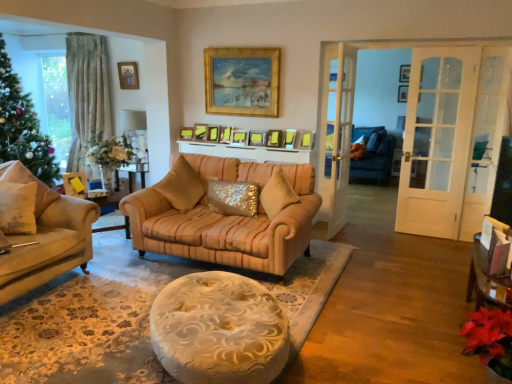
In order to face gold sequined pillow at center, the 3th pillow when ordered from right to left, should I rotate leftwards or rightwards?

A 9.716 degree turn to the left will do.

What is the approximate width of matte gold picture frame at center, which is the fourth picture frame in front-to-back order?

matte gold picture frame at center, which is the fourth picture frame in front-to-back order, is 4.35 inches in width.

Find the location of `matte yellow picture frame at center, marked as the eighth picture frame in a front-to-back arrangement`. matte yellow picture frame at center, marked as the eighth picture frame in a front-to-back arrangement is located at coordinates (200, 132).

Where is `wooden picture frame at upper center, the 2th picture frame from the back`? The image size is (512, 384). wooden picture frame at upper center, the 2th picture frame from the back is located at coordinates (404, 73).

You are a GUI agent. You are given a task and a screenshot of the screen. Output one action in this format:
    pyautogui.click(x=<x>, y=<y>)
    Task: Click on the picture frame on the left of matte white lampshade at upper left
    This screenshot has height=384, width=512.
    Given the screenshot: What is the action you would take?
    pyautogui.click(x=128, y=75)

From the image's perspective, is wooden picture frame at upper left, the 1th picture frame in the left-to-right sequence, positioned above or below matte white lampshade at upper left?

Clearly, from the image's perspective, wooden picture frame at upper left, the 1th picture frame in the left-to-right sequence, is above matte white lampshade at upper left.

Is wooden picture frame at upper left, the 3th picture frame positioned from the back, next to matte white lampshade at upper left and touching it?

There is a gap between wooden picture frame at upper left, the 3th picture frame positioned from the back, and matte white lampshade at upper left.

From the image's perspective, which is below, gold-framed painting at upper center, which is the sixth picture frame from right to left, or matte silver picture frame at center, which ranks as the 6th picture frame in left-to-right order?

matte silver picture frame at center, which ranks as the 6th picture frame in left-to-right order, is shown below in the image.

Is gold-framed painting at upper center, which is the sixth picture frame from right to left, not close to matte silver picture frame at center, the fifth picture frame positioned from the front?

No, gold-framed painting at upper center, which is the sixth picture frame from right to left, is not far away from matte silver picture frame at center, the fifth picture frame positioned from the front.

Does gold-framed painting at upper center, which is the first picture frame from front to back, contain matte silver picture frame at center, marked as the eighth picture frame in a back-to-front arrangement?

Definitely not — matte silver picture frame at center, marked as the eighth picture frame in a back-to-front arrangement, is not inside gold-framed painting at upper center, which is the first picture frame from front to back.

Considering the relative sizes of gold-framed painting at upper center, which is the sixth picture frame from right to left, and matte silver picture frame at center, which ranks as the 6th picture frame in left-to-right order, in the image provided, is gold-framed painting at upper center, which is the sixth picture frame from right to left, thinner than matte silver picture frame at center, which ranks as the 6th picture frame in left-to-right order,?

Yes, gold-framed painting at upper center, which is the sixth picture frame from right to left, is thinner than matte silver picture frame at center, which ranks as the 6th picture frame in left-to-right order.

Is wooden picture frame at upper center, marked as the twelfth picture frame in a front-to-back arrangement, placed right next to wooden picture frame at upper center, which is the 11th picture frame from front to back?

No, wooden picture frame at upper center, marked as the twelfth picture frame in a front-to-back arrangement, is not making contact with wooden picture frame at upper center, which is the 11th picture frame from front to back.

Is wooden picture frame at upper center, which is the second picture frame in right-to-left order, inside or outside of wooden picture frame at upper center, the twelfth picture frame positioned from the left?

wooden picture frame at upper center, which is the second picture frame in right-to-left order, is outside wooden picture frame at upper center, the twelfth picture frame positioned from the left.

Is the position of wooden picture frame at upper center, marked as the twelfth picture frame in a front-to-back arrangement, more distant than that of wooden picture frame at upper center, the twelfth picture frame positioned from the left?

Yes, it is behind wooden picture frame at upper center, the twelfth picture frame positioned from the left.

Is wooden picture frame at upper center, marked as the eleventh picture frame in a left-to-right arrangement, taller than wooden picture frame at upper center, the 2th picture frame from the back?

Indeed, wooden picture frame at upper center, marked as the eleventh picture frame in a left-to-right arrangement, has a greater height compared to wooden picture frame at upper center, the 2th picture frame from the back.

Which of these two, matte gold picture frame at center, which ranks as the 2th picture frame in left-to-right order, or matte wooden picture frame at center, the 11th picture frame from the back, is bigger?

With larger size is matte gold picture frame at center, which ranks as the 2th picture frame in left-to-right order.

Who is more distant, matte gold picture frame at center, which is the ninth picture frame from front to back, or matte wooden picture frame at center, the 3th picture frame positioned from the right?

matte gold picture frame at center, which is the ninth picture frame from front to back.

From the image's perspective, is matte gold picture frame at center, which is the ninth picture frame from front to back, under matte wooden picture frame at center, the 2th picture frame when ordered from front to back?

Actually, matte gold picture frame at center, which is the ninth picture frame from front to back, appears above matte wooden picture frame at center, the 2th picture frame when ordered from front to back, in the image.

From the image's perspective, starting from the matte gold picture frame at center, which is the eleventh picture frame in right-to-left order, which picture frame is the 5th one below? Please provide its 2D coordinates.

[(290, 138)]

Who is smaller, matte gold picture frame at center, which is counted as the 7th picture frame, starting from the front, or matte gold picture frame at center, acting as the 9th picture frame starting from the left?

matte gold picture frame at center, acting as the 9th picture frame starting from the left.

From a real-world perspective, is matte gold picture frame at center, which is counted as the 7th picture frame, starting from the front, located beneath matte gold picture frame at center, the 10th picture frame when ordered from back to front?

No, from a real-world perspective, matte gold picture frame at center, which is counted as the 7th picture frame, starting from the front, is not beneath matte gold picture frame at center, the 10th picture frame when ordered from back to front.

Image resolution: width=512 pixels, height=384 pixels. Identify the location of the 4th picture frame located beneath the matte gold picture frame at center, the ninth picture frame in the right-to-left sequence (from a real-world perspective). (274, 138).

Considering the relative sizes of matte silver picture frame at center, which ranks as the 6th picture frame in left-to-right order, and gold sequined pillow at center, the 3th pillow when ordered from right to left, in the image provided, is matte silver picture frame at center, which ranks as the 6th picture frame in left-to-right order, smaller than gold sequined pillow at center, the 3th pillow when ordered from right to left,?

Correct, matte silver picture frame at center, which ranks as the 6th picture frame in left-to-right order, occupies less space than gold sequined pillow at center, the 3th pillow when ordered from right to left.

In the image, is matte silver picture frame at center, the fifth picture frame positioned from the front, positioned in front of or behind gold sequined pillow at center, which ranks as the third pillow in left-to-right order?

matte silver picture frame at center, the fifth picture frame positioned from the front, is positioned farther from the viewer than gold sequined pillow at center, which ranks as the third pillow in left-to-right order.

From a real-world perspective, is matte silver picture frame at center, which ranks as the 6th picture frame in left-to-right order, above or below gold sequined pillow at center, which ranks as the third pillow in left-to-right order?

Clearly, from a real-world perspective, matte silver picture frame at center, which ranks as the 6th picture frame in left-to-right order, is above gold sequined pillow at center, which ranks as the third pillow in left-to-right order.

Are matte silver picture frame at center, which ranks as the 6th picture frame in left-to-right order, and gold sequined pillow at center, the 3th pillow when ordered from right to left, located far from each other?

matte silver picture frame at center, which ranks as the 6th picture frame in left-to-right order, is far away from gold sequined pillow at center, the 3th pillow when ordered from right to left.

Would you say beige fabric pillow at left, the 5th pillow positioned from the right, is outside gold sequined pillow at center, the 3th pillow when ordered from right to left?

Yes, beige fabric pillow at left, the 5th pillow positioned from the right, is not within gold sequined pillow at center, the 3th pillow when ordered from right to left.

Between beige fabric pillow at left, the 5th pillow positioned from the right, and gold sequined pillow at center, which ranks as the third pillow in left-to-right order, which one appears on the left side from the viewer's perspective?

beige fabric pillow at left, the 5th pillow positioned from the right.

Is point (47, 205) positioned behind point (192, 202)?

No.

Is beige fabric pillow at left, the 5th pillow positioned from the right, not close to gold sequined pillow at center, which ranks as the third pillow in left-to-right order?

Absolutely, beige fabric pillow at left, the 5th pillow positioned from the right, is distant from gold sequined pillow at center, which ranks as the third pillow in left-to-right order.

The height and width of the screenshot is (384, 512). I want to click on lamp that is below the wooden picture frame at upper left, the 3th picture frame positioned from the back (from the image's perspective), so click(135, 132).

Which picture frame is the 4th one when counting from the front of the matte silver picture frame at center, the fifth picture frame positioned from the front? Please provide its 2D coordinates.

[(242, 81)]

Estimate the real-world distances between objects in this image. Which object is closer to matte gold picture frame at center, the 4th picture frame positioned from the left, beige fabric side table at left or gold-framed painting at upper center, which is the sixth picture frame from right to left?

gold-framed painting at upper center, which is the sixth picture frame from right to left, lies closer to matte gold picture frame at center, the 4th picture frame positioned from the left, than the other object.

Which object lies nearer to the anchor point sparkly gold pillow at center, the 4th pillow viewed from the left, matte silver picture frame at center, the fifth picture frame positioned from the front, or wooden picture frame at upper left, the 3th picture frame positioned from the back?

Among the two, matte silver picture frame at center, the fifth picture frame positioned from the front, is located nearer to sparkly gold pillow at center, the 4th pillow viewed from the left.

Based on their spatial positions, is matte gold picture frame at center, the 3th picture frame from the front, or matte gold picture frame at center, which is counted as the 7th picture frame, starting from the front, closer to beige fabric pillow at left, the 5th pillow positioned from the right?

Based on the image, matte gold picture frame at center, which is counted as the 7th picture frame, starting from the front, appears to be nearer to beige fabric pillow at left, the 5th pillow positioned from the right.

Considering their positions, is matte gold picture frame at center, which ranks as the 2th picture frame in left-to-right order, positioned further to gold sequined pillow at center, the 3th pillow when ordered from right to left, than matte white lampshade at upper left?

The object further to gold sequined pillow at center, the 3th pillow when ordered from right to left, is matte white lampshade at upper left.

When comparing their distances from beige fabric side table at left, does matte gold picture frame at center, the ninth picture frame in the right-to-left sequence, or matte white lampshade at upper left seem closer?

matte gold picture frame at center, the ninth picture frame in the right-to-left sequence, is positioned closer to the anchor beige fabric side table at left.

Estimate the real-world distances between objects in this image. Which object is further from shiny gold pillow at center, acting as the 1th pillow starting from the right, gold-framed painting at upper center, arranged as the 12th picture frame when viewed from the back, or sparkly gold pillow at center, the second pillow positioned from the right?

gold-framed painting at upper center, arranged as the 12th picture frame when viewed from the back.

Consider the image. From the image, which object appears to be farther from matte gold picture frame at center, the eighth picture frame viewed from the left, sparkly gold pillow at center, the 4th pillow viewed from the left, or wooden picture frame at upper center, the 2th picture frame from the back?

wooden picture frame at upper center, the 2th picture frame from the back.

Based on their spatial positions, is gold sequined pillow at center, which ranks as the third pillow in left-to-right order, or matte gold picture frame at center, the 5th picture frame viewed from the right, closer to matte yellow picture frame at center, which ranks as the third picture frame in left-to-right order?

Based on the image, matte gold picture frame at center, the 5th picture frame viewed from the right, appears to be nearer to matte yellow picture frame at center, which ranks as the third picture frame in left-to-right order.

You are a GUI agent. You are given a task and a screenshot of the screen. Output one action in this format:
    pyautogui.click(x=<x>, y=<y>)
    Task: Click on the lamp between gold textured pillow at left, which ranks as the fourth pillow in right-to-left order, and wooden picture frame at upper left, the 3th picture frame positioned from the back, along the z-axis
    The height and width of the screenshot is (384, 512).
    Given the screenshot: What is the action you would take?
    pyautogui.click(x=135, y=132)

You are a GUI agent. You are given a task and a screenshot of the screen. Output one action in this format:
    pyautogui.click(x=<x>, y=<y>)
    Task: Click on the lamp located between gold textured pillow at left, which ranks as the fourth pillow in right-to-left order, and matte wooden picture frame at center, the 11th picture frame from the back, in the left-right direction
    
    Given the screenshot: What is the action you would take?
    pyautogui.click(x=135, y=132)

I want to click on side table between gold textured pillow at left, the second pillow from the left, and gold-framed painting at upper center, which is the sixth picture frame from right to left, so click(116, 228).

Identify the location of lamp between gold sequined pillow at center, which ranks as the third pillow in left-to-right order, and wooden picture frame at upper left, the 1th picture frame in the left-to-right sequence, along the z-axis. (135, 132).